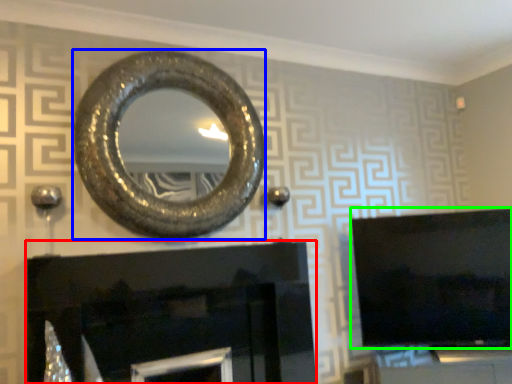
Question: Which is nearer to the fireplace (highlighted by a red box)? oval (highlighted by a blue box) or television (highlighted by a green box).

Choices:
 (A) oval
 (B) television

Answer: (A)